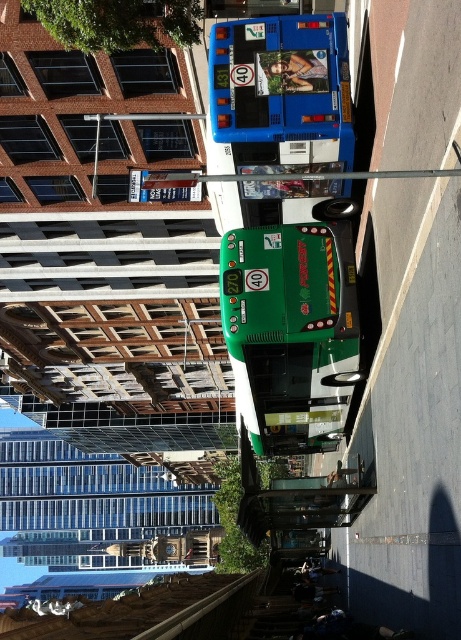
In the scene shown: Does green matte bus at center lie in front of blue metallic bus at upper center?

No, green matte bus at center is behind blue metallic bus at upper center.

Is point (347, 269) behind point (337, 150)?

That is True.

At what (x,y) coordinates should I click in order to perform the action: click on green matte bus at center. Please return your answer as a coordinate pair (x, y). Looking at the image, I should click on (290, 332).